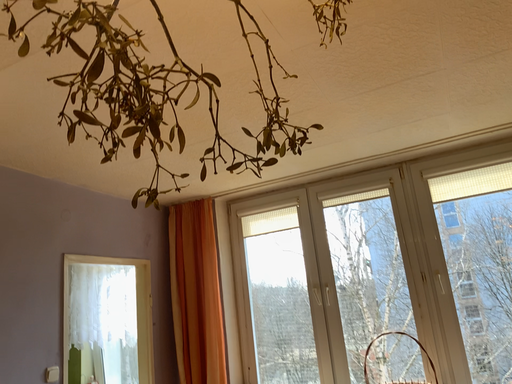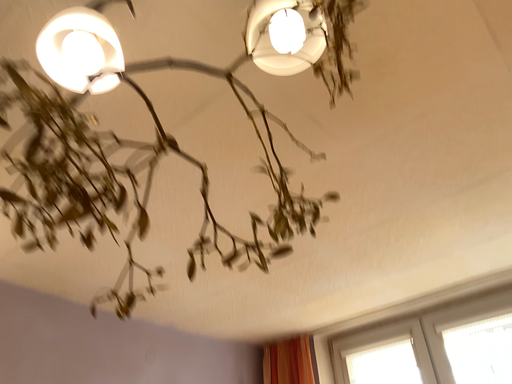
Question: Which way did the camera rotate in the video?

Choices:
 (A) rotated upward
 (B) rotated downward

Answer: (A)